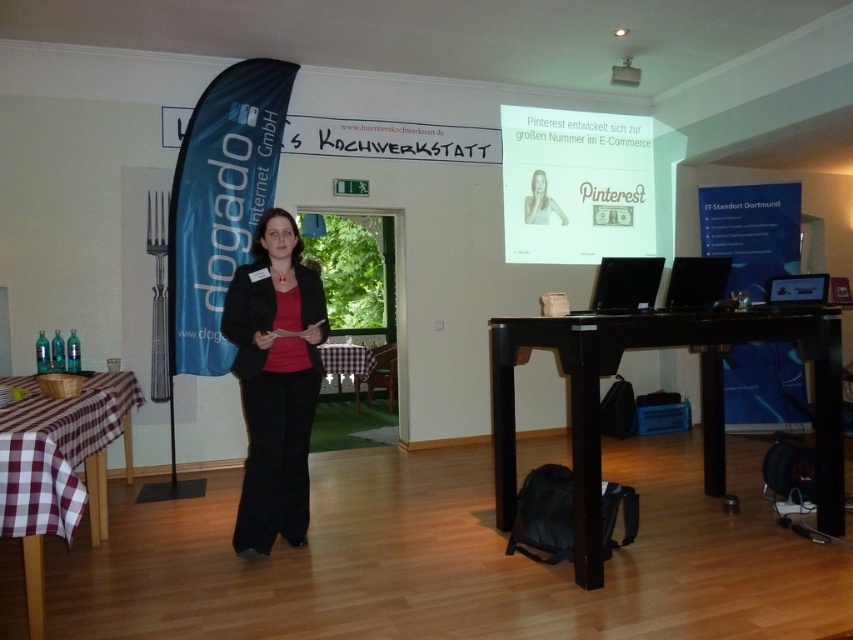
Question: Does black glossy laptop at center have a larger size compared to black glossy monitor at right?

Choices:
 (A) no
 (B) yes

Answer: (B)

Question: Which point is closer to the camera?

Choices:
 (A) (827, 275)
 (B) (36, 420)
 (C) (709, 301)

Answer: (B)

Question: Does black glossy monitor at right appear on the left side of silver metallic laptop at right?

Choices:
 (A) no
 (B) yes

Answer: (B)

Question: Which point is farther to the camera?

Choices:
 (A) black glossy laptop at center
 (B) black glossy monitor at right
 (C) checkered fabric table at center

Answer: (C)

Question: Which of the following is the farthest from the observer?

Choices:
 (A) smooth skin woman at center
 (B) checkered fabric table at center
 (C) black fabric jacket at center
 (D) black glossy table at center

Answer: (A)

Question: Can you confirm if black glossy laptop at center is positioned to the right of checkered fabric table at center?

Choices:
 (A) no
 (B) yes

Answer: (B)